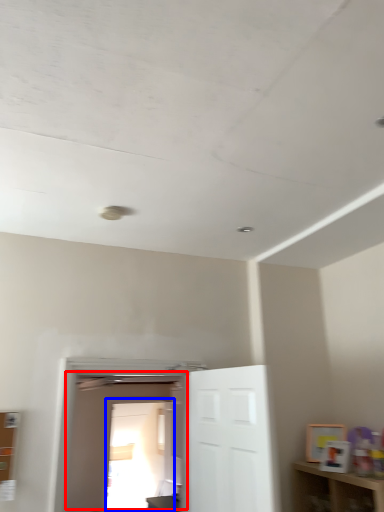
Question: Among these objects, which one is farthest to the camera, door (highlighted by a red box) or glass door (highlighted by a blue box)?

Choices:
 (A) door
 (B) glass door

Answer: (B)